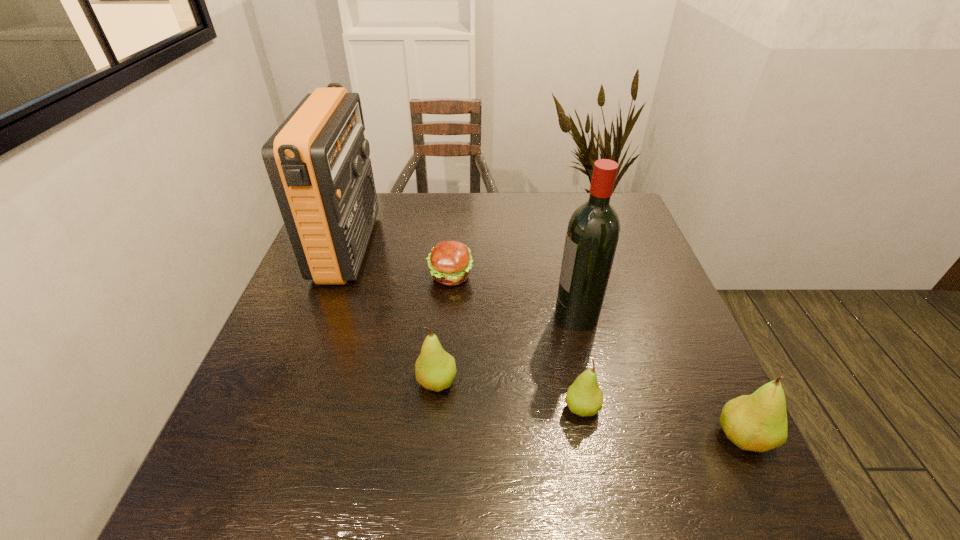
This screenshot has height=540, width=960. In order to click on vacant space positioned on the left of the rightmost object in this screenshot , I will do `click(526, 437)`.

In order to click on free location located on the back of the hamburger in this screenshot , I will do `click(452, 251)`.

What are the coordinates of `free spot located on the front-facing side of the leftmost object` in the screenshot? It's located at (467, 247).

Where is `free spot located 0.350m on the label of the wine bottle`? The height and width of the screenshot is (540, 960). free spot located 0.350m on the label of the wine bottle is located at coordinates (408, 315).

Where is `free location located on the label of the wine bottle`? The height and width of the screenshot is (540, 960). free location located on the label of the wine bottle is located at coordinates (445, 315).

Find the location of a particular element. The width and height of the screenshot is (960, 540). free region located on the label of the wine bottle is located at coordinates (463, 315).

Locate an element on the screen. Image resolution: width=960 pixels, height=540 pixels. object that is positioned at the far edge is located at coordinates (317, 161).

Locate an element on the screen. The width and height of the screenshot is (960, 540). object at the left edge is located at coordinates (317, 161).

I want to click on object situated at the right edge, so click(x=757, y=422).

Where is `object that is at the far left corner`? This screenshot has height=540, width=960. object that is at the far left corner is located at coordinates (317, 161).